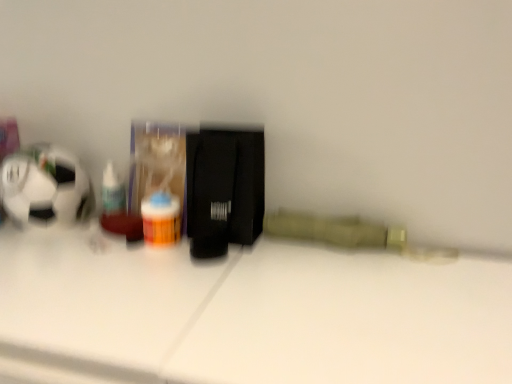
Question: Considering the relative sizes of translucent plastic bottle at left and translucent plastic pill bottle at center in the image provided, is translucent plastic bottle at left smaller than translucent plastic pill bottle at center?

Choices:
 (A) no
 (B) yes

Answer: (B)

Question: From a real-world perspective, is translucent plastic bottle at left on top of translucent plastic pill bottle at center?

Choices:
 (A) yes
 (B) no

Answer: (A)

Question: Can you confirm if translucent plastic bottle at left is bigger than translucent plastic pill bottle at center?

Choices:
 (A) yes
 (B) no

Answer: (B)

Question: Considering the relative positions of translucent plastic bottle at left and translucent plastic pill bottle at center in the image provided, is translucent plastic bottle at left to the right of translucent plastic pill bottle at center from the viewer's perspective?

Choices:
 (A) yes
 (B) no

Answer: (B)

Question: From a real-world perspective, is translucent plastic bottle at left below translucent plastic pill bottle at center?

Choices:
 (A) yes
 (B) no

Answer: (B)

Question: Is translucent plastic bottle at left outside translucent plastic pill bottle at center?

Choices:
 (A) no
 (B) yes

Answer: (B)

Question: From the image's perspective, is white glossy table at center under translucent plastic bottle at left?

Choices:
 (A) no
 (B) yes

Answer: (B)

Question: From a real-world perspective, is white glossy table at center over translucent plastic bottle at left?

Choices:
 (A) no
 (B) yes

Answer: (A)

Question: Is white glossy table at center oriented towards translucent plastic bottle at left?

Choices:
 (A) no
 (B) yes

Answer: (A)

Question: Is the position of white glossy table at center more distant than that of translucent plastic bottle at left?

Choices:
 (A) yes
 (B) no

Answer: (B)

Question: From the image's perspective, is white glossy table at center on translucent plastic bottle at left?

Choices:
 (A) no
 (B) yes

Answer: (A)

Question: Would you say white glossy table at center contains translucent plastic bottle at left?

Choices:
 (A) no
 (B) yes

Answer: (A)

Question: Does white glossy table at center appear on the left side of translucent plastic pill bottle at center?

Choices:
 (A) yes
 (B) no

Answer: (B)